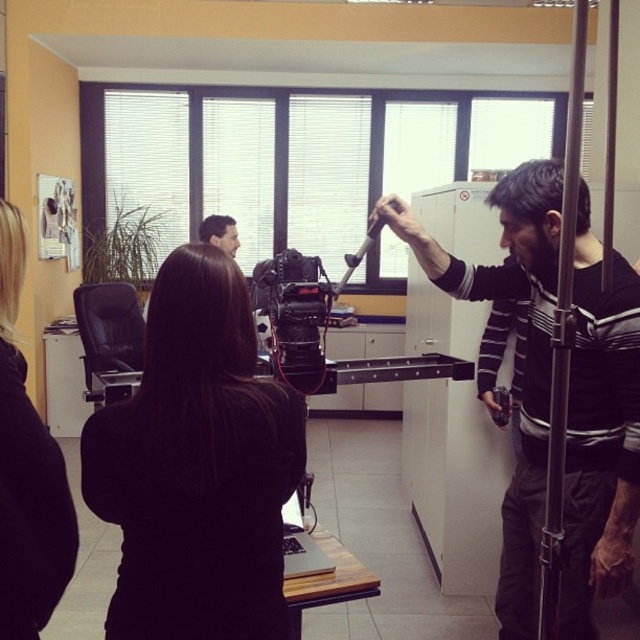
You are a photographer in the studio and need to adjust the lighting so that the black matte video camera at center is clearly visible in the photo. However, the black matte hair at center is blocking part of the camera. Based on their positions, which object should you move to ensure the camera is fully visible?

The black matte hair at center is in front of the black matte video camera at center, so moving the black matte hair at center would allow the camera to be fully visible.

You are standing in the office and want to reach both the point at coordinates (301, 280) and the point at (532, 195). Which point should you approach first if you want to touch them in order from closest to farthest?

You should first approach point (301, 280) because it is closer to you than point (532, 195).

In the scene, there are two people with distinct hairstyles. The first has black matte hair at center and the second has dark brown hair at upper right. Which hairstyle has a greater width?

The black matte hair at center has a greater width compared to the dark brown hair at upper right.